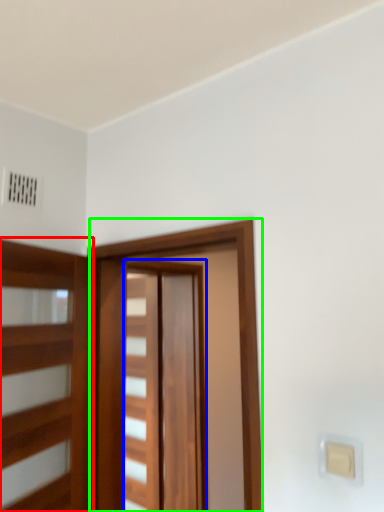
Question: Considering the real-world distances, which object is closest to elevator (highlighted by a red box)? barn door (highlighted by a blue box) or barn door (highlighted by a green box).

Choices:
 (A) barn door
 (B) barn door

Answer: (B)